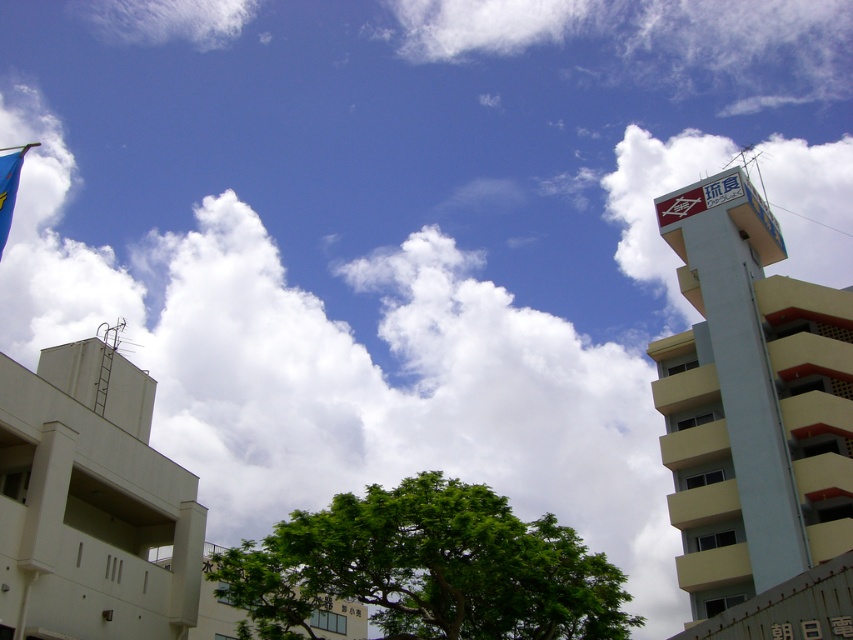
You are standing in the urban area looking up at the sky. You notice the yellow matte tower at upper right and the blue fabric flag at upper left. Which object is positioned lower in the image?

The yellow matte tower at upper right is positioned below the blue fabric flag at upper left, so it is lower in the image.

You are a drone operator who needs to fly a drone from the yellow matte tower at upper right to the blue fabric flag at upper left. According to the scene description, what is the minimum distance the drone must travel in meters?

The yellow matte tower at upper right is 53.90 meters away from the blue fabric flag at upper left, so the minimum distance the drone must travel is 53.90 meters.